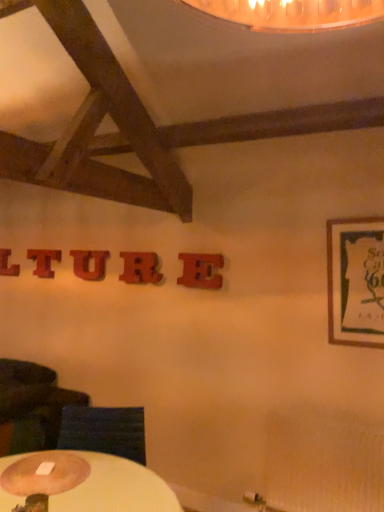
Question: Is wooden letter at center, which is the second letter in front-to-back order, bigger than wooden letter at upper left, the 2th letter viewed from the back?

Choices:
 (A) no
 (B) yes

Answer: (B)

Question: Considering the relative sizes of wooden letter at center, which is the 2th letter from right to left, and wooden letter at upper left, the 2th letter viewed from the left, in the image provided, is wooden letter at center, which is the 2th letter from right to left, shorter than wooden letter at upper left, the 2th letter viewed from the left,?

Choices:
 (A) yes
 (B) no

Answer: (B)

Question: From the image's perspective, is wooden letter at center, which is the second letter in front-to-back order, above wooden letter at upper left, the 2th letter viewed from the left?

Choices:
 (A) no
 (B) yes

Answer: (A)

Question: From a real-world perspective, is wooden letter at center, placed as the fourth letter when sorted from left to right, physically above wooden letter at upper left, the 2th letter viewed from the left?

Choices:
 (A) yes
 (B) no

Answer: (B)

Question: Is wooden letter at center, placed as the fourth letter when sorted from left to right, closer to camera compared to wooden letter at upper left, the 2th letter viewed from the left?

Choices:
 (A) no
 (B) yes

Answer: (B)

Question: Can you see wooden letter at center, marked as the fourth letter in a back-to-front arrangement, touching wooden letter at upper left, the 2th letter viewed from the left?

Choices:
 (A) yes
 (B) no

Answer: (B)

Question: Is wooden coaster at lower left not near red wood letter at center, the 5th letter from the front?

Choices:
 (A) yes
 (B) no

Answer: (A)

Question: Can you confirm if wooden coaster at lower left is smaller than red wood letter at center, the fifth letter viewed from the right?

Choices:
 (A) yes
 (B) no

Answer: (B)

Question: Does wooden coaster at lower left have a larger size compared to red wood letter at center, the 5th letter from the front?

Choices:
 (A) no
 (B) yes

Answer: (B)

Question: From a real-world perspective, is wooden coaster at lower left below red wood letter at center, the 5th letter from the front?

Choices:
 (A) yes
 (B) no

Answer: (A)

Question: Would you say wooden coaster at lower left contains red wood letter at center, the fifth letter viewed from the right?

Choices:
 (A) yes
 (B) no

Answer: (B)

Question: Considering the relative positions of wooden coaster at lower left and red wood letter at center, arranged as the 1th letter when viewed from the left, in the image provided, is wooden coaster at lower left in front of red wood letter at center, arranged as the 1th letter when viewed from the left,?

Choices:
 (A) no
 (B) yes

Answer: (B)

Question: Can you confirm if wooden framed poster at right is taller than wooden letter at center, marked as the fourth letter in a back-to-front arrangement?

Choices:
 (A) no
 (B) yes

Answer: (B)